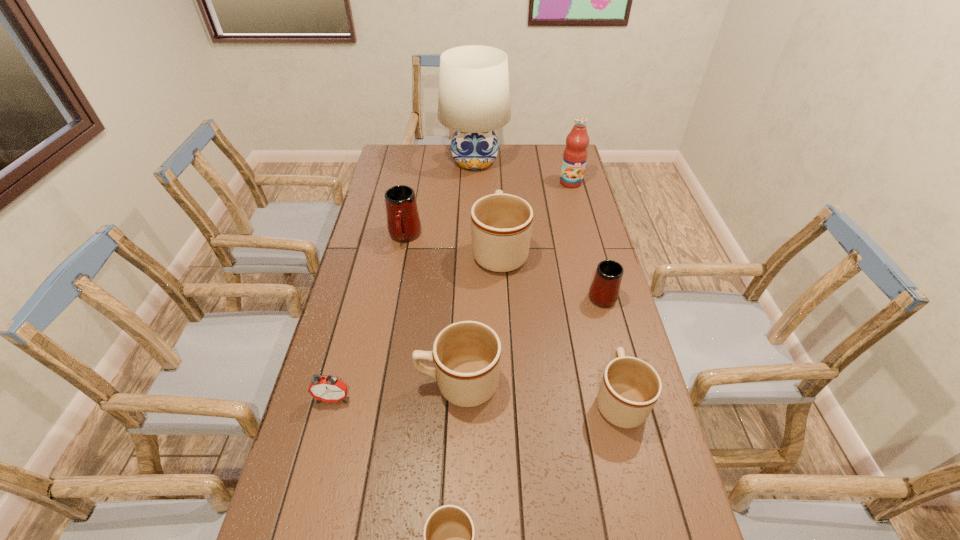
Where is `free space located 0.370m on the side of the third biggest brown mug with the handle`? Image resolution: width=960 pixels, height=540 pixels. free space located 0.370m on the side of the third biggest brown mug with the handle is located at coordinates (588, 277).

Locate an element on the screen. vacant position located on the side of the third biggest brown mug with the handle is located at coordinates (590, 281).

This screenshot has width=960, height=540. I want to click on free region located 0.390m on the side of the third biggest brown mug with the handle, so click(x=588, y=273).

Where is `blank space located 0.200m on the side of the fifth farthest object with the handle`? This screenshot has height=540, width=960. blank space located 0.200m on the side of the fifth farthest object with the handle is located at coordinates pyautogui.click(x=588, y=242).

Find the location of a particular element. free space located on the side of the fifth farthest object with the handle is located at coordinates (583, 224).

This screenshot has height=540, width=960. What are the coordinates of `free space located on the side of the fifth farthest object with the handle` in the screenshot? It's located at [x=582, y=222].

I want to click on vacant region located 0.080m on the clock face of the alarm clock, so click(x=324, y=435).

Locate an element on the screen. The image size is (960, 540). object present at the far edge is located at coordinates (474, 97).

At what (x,y) coordinates should I click in order to perform the action: click on mug that is at the left edge. Please return your answer as a coordinate pair (x, y). This screenshot has width=960, height=540. Looking at the image, I should click on (403, 222).

The image size is (960, 540). What are the coordinates of `alarm clock situated at the left edge` in the screenshot? It's located at (327, 389).